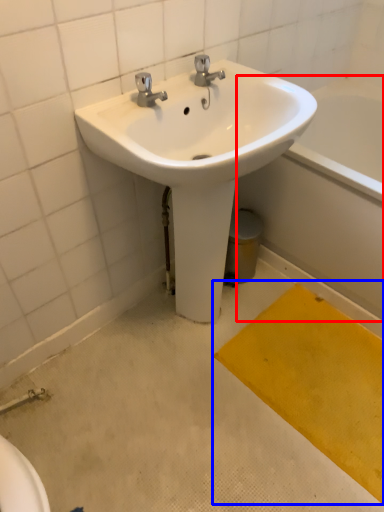
Question: Which of the following is the farthest to the observer, bath (highlighted by a red box) or doormat (highlighted by a blue box)?

Choices:
 (A) bath
 (B) doormat

Answer: (A)